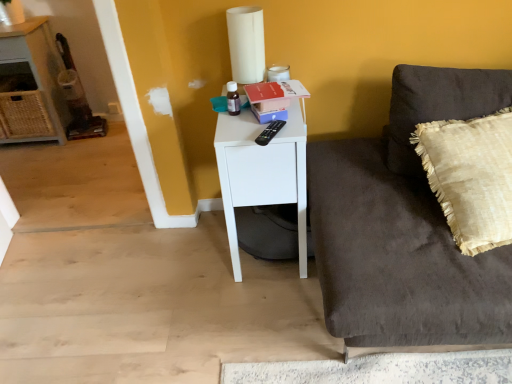
Image resolution: width=512 pixels, height=384 pixels. I want to click on free space that is to the left of white matte side table at center, so (x=184, y=260).